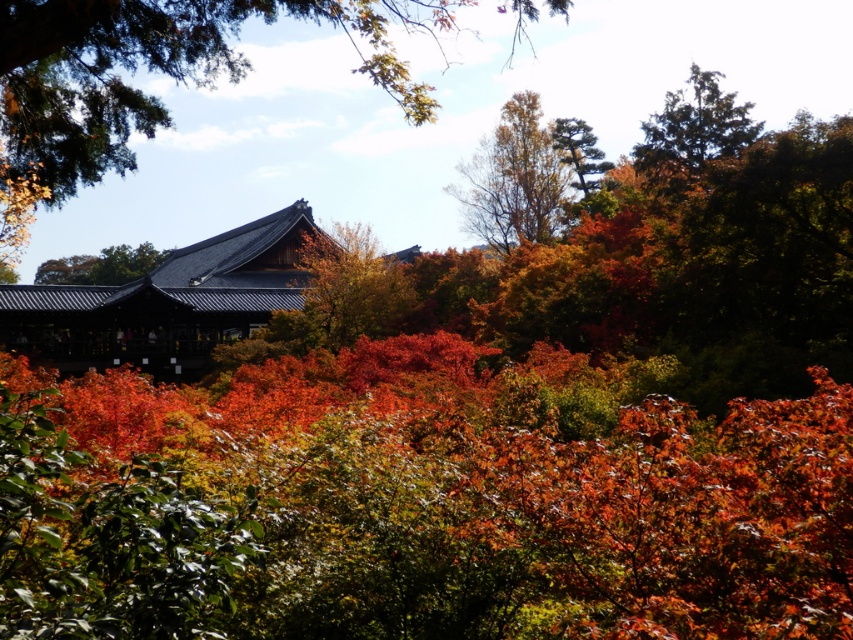
You are standing in the autumnal scene described. There is a point marked at coordinates point (345,291). What object is located at that point?

A: The point (345,291) corresponds to the smooth brown tree trunk at center.

You are a painter standing in front of an autumn landscape. You want to paint the smooth brown tree trunk at center and the brown textured tree at upper center. Which tree is positioned lower in the scene?

The smooth brown tree trunk at center is positioned lower than the brown textured tree at upper center.

In the autumnal scene with a dense cluster of trees and a traditional Japanese building, there is a point marked at coordinates (514,179). What object is located at this specific coordinate?

The brown textured tree at upper center is located at point (514,179).